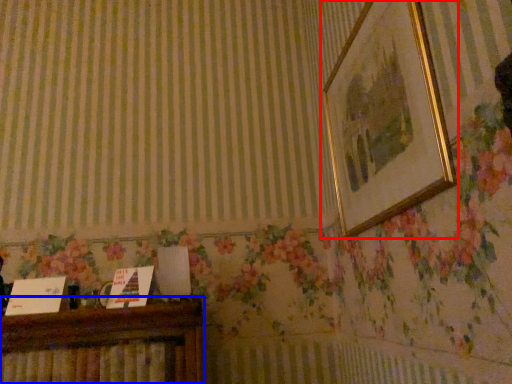
Question: Which object is closer to the camera taking this photo, picture frame (highlighted by a red box) or furniture (highlighted by a blue box)?

Choices:
 (A) picture frame
 (B) furniture

Answer: (A)